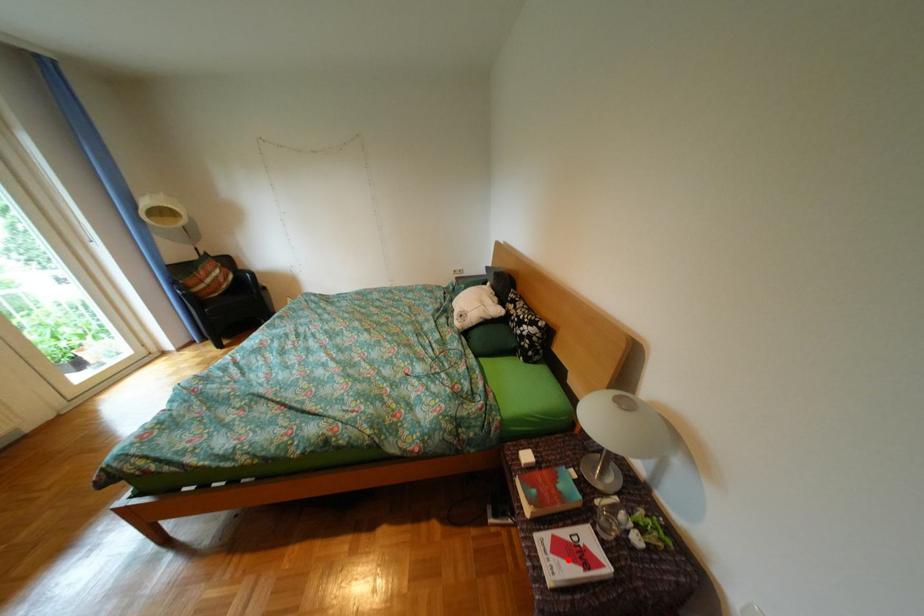
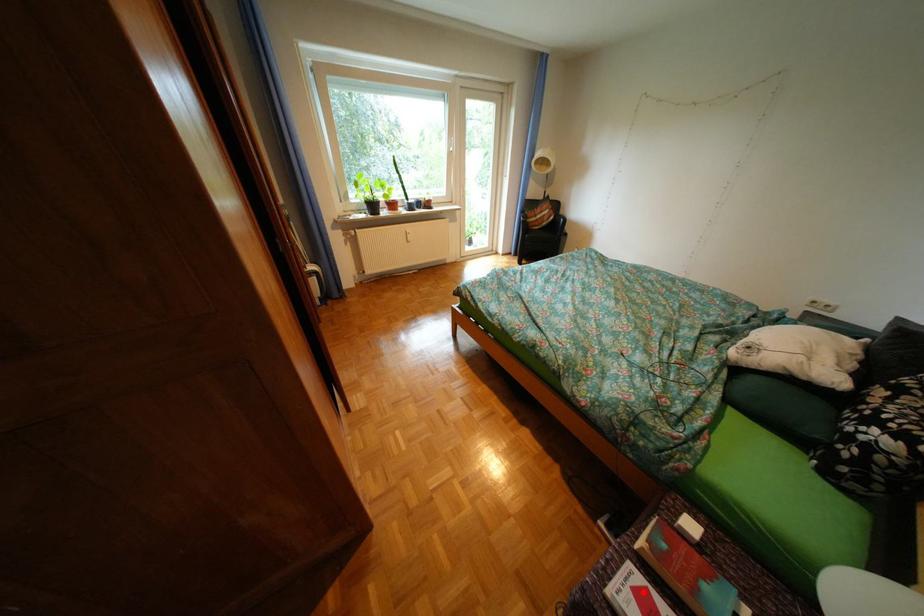
I am providing you with two images of the same scene from different viewpoints. A red point is marked on the first image and another point is marked on the second image. Are the points marked in image1 and image2 representing the same 3D position?

Yes